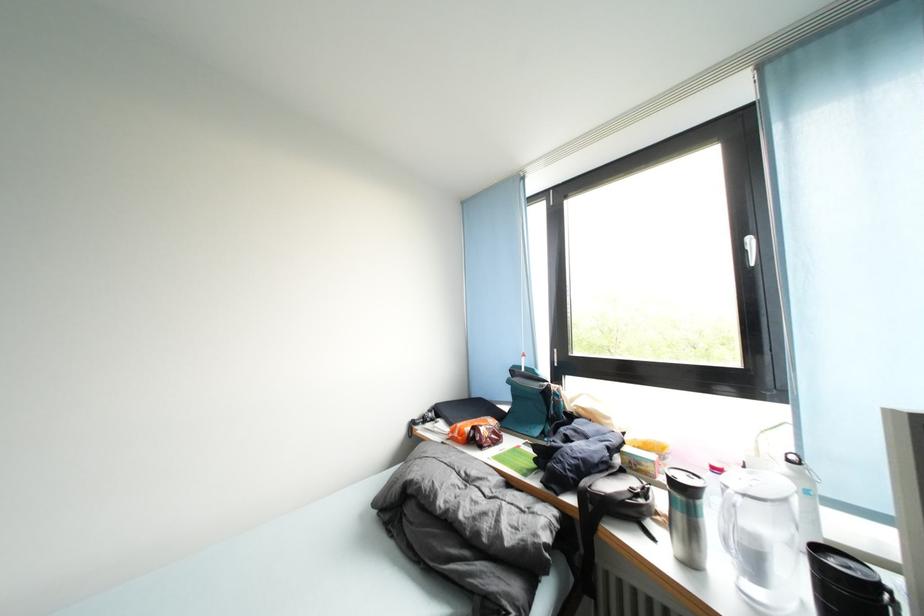
The image size is (924, 616). In order to click on black mug handle in this screenshot , I will do `click(891, 583)`.